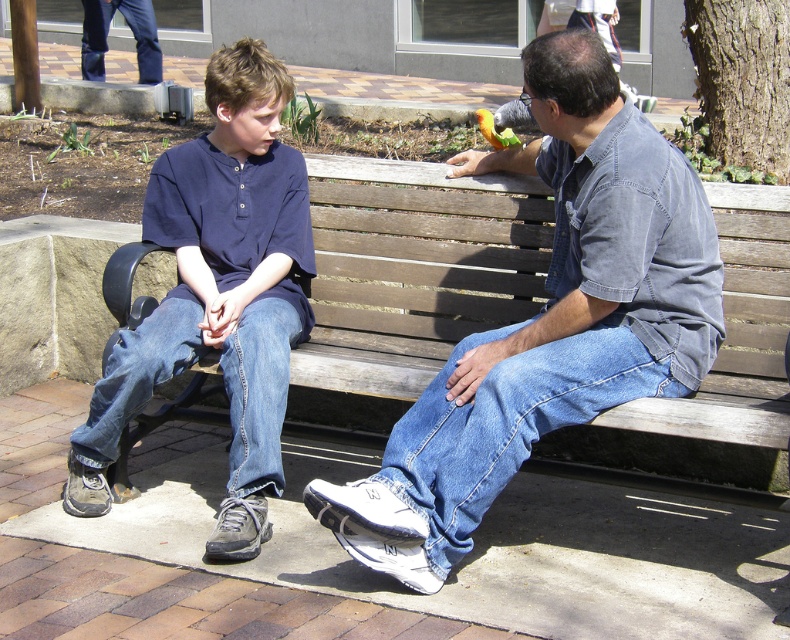
Is dark blue jeans at upper left shorter than yellow-green parrot at upper center?

In fact, dark blue jeans at upper left may be taller than yellow-green parrot at upper center.

Does dark blue jeans at upper left appear over yellow-green parrot at upper center?

Yes.

This screenshot has height=640, width=790. I want to click on dark blue jeans at upper left, so click(x=106, y=35).

Locate an element on the screen. The height and width of the screenshot is (640, 790). dark blue jeans at upper left is located at coordinates (106, 35).

Which is behind, point (322, 360) or point (138, 10)?

The point (138, 10) is behind.

Does wooden bench at center have a lesser height compared to dark blue jeans at upper left?

Yes, wooden bench at center is shorter than dark blue jeans at upper left.

Identify the location of wooden bench at center. (412, 268).

Who is shorter, denim jeans at center or wooden bench at center?

wooden bench at center

Is denim jeans at center wider than wooden bench at center?

Correct, the width of denim jeans at center exceeds that of wooden bench at center.

At what (x,y) coordinates should I click in order to perform the action: click on denim jeans at center. Please return your answer as a coordinate pair (x, y). Looking at the image, I should click on (548, 321).